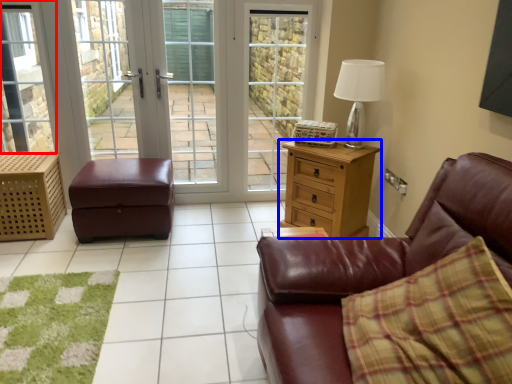
Question: Which object is further to the camera taking this photo, window (highlighted by a red box) or chest of drawers (highlighted by a blue box)?

Choices:
 (A) window
 (B) chest of drawers

Answer: (A)